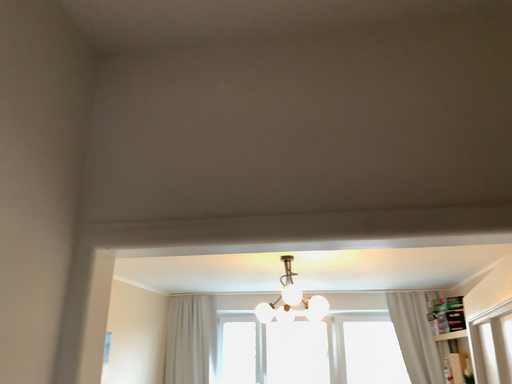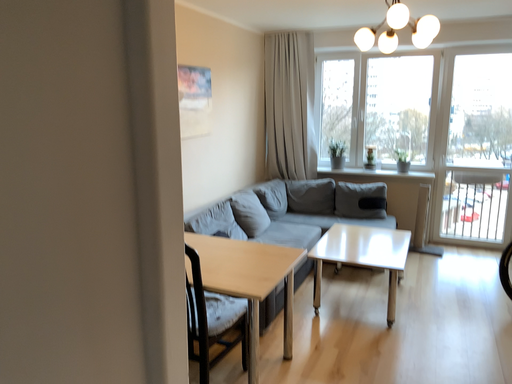
Question: Which way did the camera rotate in the video?

Choices:
 (A) rotated upward
 (B) rotated downward

Answer: (B)